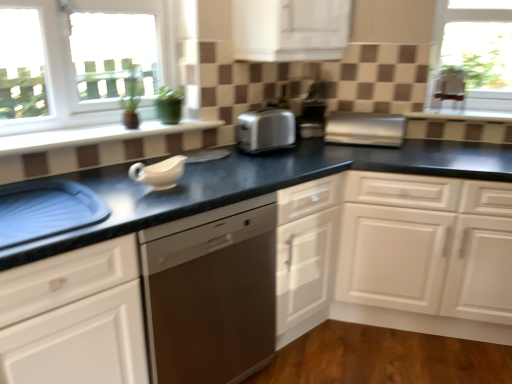
Question: Is white glossy cabinet at upper center, the 1th cabinetry when ordered from top to bottom, aimed at blue plastic tray at lower left?

Choices:
 (A) no
 (B) yes

Answer: (A)

Question: Can you confirm if white glossy cabinet at upper center, the 1th cabinetry when ordered from top to bottom, is bigger than blue plastic tray at lower left?

Choices:
 (A) yes
 (B) no

Answer: (A)

Question: From a real-world perspective, is white glossy cabinet at upper center, the second cabinetry ordered from the bottom, positioned over blue plastic tray at lower left based on gravity?

Choices:
 (A) yes
 (B) no

Answer: (A)

Question: From the image's perspective, does white glossy cabinet at upper center, the 1th cabinetry when ordered from top to bottom, appear higher than blue plastic tray at lower left?

Choices:
 (A) no
 (B) yes

Answer: (B)

Question: Is white glossy cabinet at upper center, the second cabinetry ordered from the bottom, touching blue plastic tray at lower left?

Choices:
 (A) no
 (B) yes

Answer: (A)

Question: From their relative heights in the image, would you say satin silver toaster at center is taller or shorter than white matte cabinet at center, positioned as the first cabinetry in bottom-to-top order?

Choices:
 (A) short
 (B) tall

Answer: (A)

Question: Based on their positions, is satin silver toaster at center located to the left or right of white matte cabinet at center, positioned as the first cabinetry in bottom-to-top order?

Choices:
 (A) left
 (B) right

Answer: (A)

Question: Is satin silver toaster at center spatially inside white matte cabinet at center, which appears as the 2th cabinetry when viewed from the top, or outside of it?

Choices:
 (A) inside
 (B) outside

Answer: (B)

Question: Considering the positions of satin silver toaster at center and white matte cabinet at center, which appears as the 2th cabinetry when viewed from the top, in the image, is satin silver toaster at center wider or thinner than white matte cabinet at center, which appears as the 2th cabinetry when viewed from the top,?

Choices:
 (A) thin
 (B) wide

Answer: (A)

Question: Is blue plastic tray at lower left bigger or smaller than satin silver toaster at center?

Choices:
 (A) small
 (B) big

Answer: (B)

Question: Is point (29, 183) positioned closer to the camera than point (396, 140)?

Choices:
 (A) closer
 (B) farther

Answer: (A)

Question: In the image, is blue plastic tray at lower left positioned in front of or behind satin silver toaster at center?

Choices:
 (A) behind
 (B) front

Answer: (B)

Question: From their relative heights in the image, would you say blue plastic tray at lower left is taller or shorter than satin silver toaster at center?

Choices:
 (A) tall
 (B) short

Answer: (A)

Question: Does point (96, 130) appear closer or farther from the camera than point (482, 178)?

Choices:
 (A) farther
 (B) closer

Answer: (B)

Question: Looking at their shapes, would you say white ceramic window sill at upper left is wider or thinner than black granite countertop at center?

Choices:
 (A) wide
 (B) thin

Answer: (B)